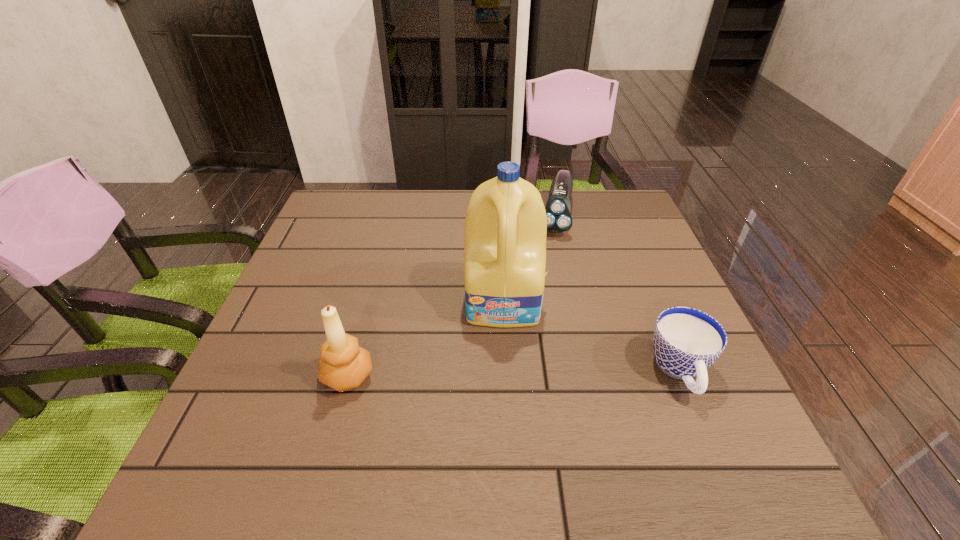
Identify the location of free space located 0.150m on the label of the detergent. (505, 387).

This screenshot has width=960, height=540. In order to click on blank space located 0.120m on the head of the second object from right to left in this screenshot , I will do `click(551, 266)`.

Where is `vacant space situated 0.310m on the head of the second object from right to left`? The width and height of the screenshot is (960, 540). vacant space situated 0.310m on the head of the second object from right to left is located at coordinates (541, 319).

The image size is (960, 540). What are the coordinates of `vacant region located 0.090m on the head of the second object from right to left` in the screenshot? It's located at (552, 259).

Identify the location of object that is at the far edge. Image resolution: width=960 pixels, height=540 pixels. (558, 207).

The height and width of the screenshot is (540, 960). In order to click on candle_holder located at the near edge in this screenshot , I will do [343, 366].

Where is `cup that is at the near edge`? The width and height of the screenshot is (960, 540). cup that is at the near edge is located at coordinates (686, 342).

Locate an element on the screen. The height and width of the screenshot is (540, 960). object positioned at the left edge is located at coordinates (343, 366).

Find the location of a particular element. object located at the right edge is located at coordinates (686, 342).

Where is `object at the near left corner`? object at the near left corner is located at coordinates (343, 366).